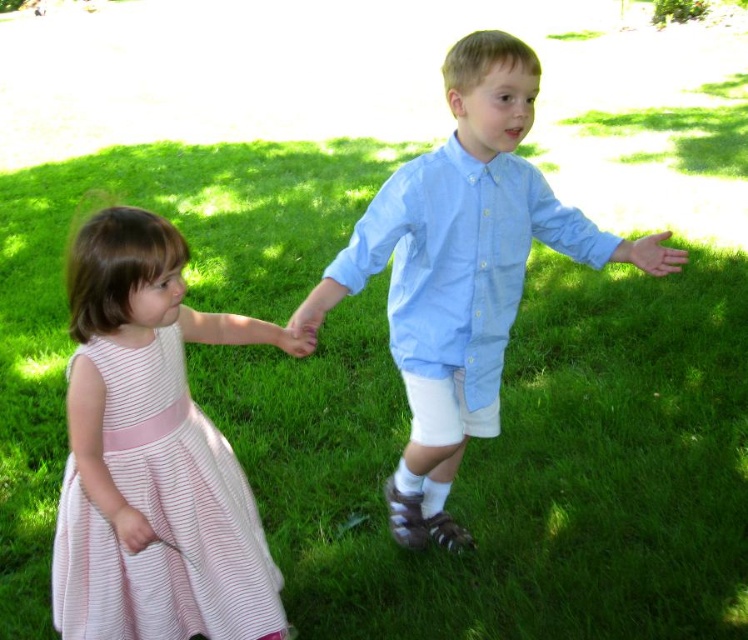
Who is more forward, (411, 545) or (218, 490)?

Point (218, 490) is in front.

Can you confirm if light blue cotton shirt at center is positioned to the left of pink striped fabric dress at left?

Incorrect, light blue cotton shirt at center is not on the left side of pink striped fabric dress at left.

You are a GUI agent. You are given a task and a screenshot of the screen. Output one action in this format:
    pyautogui.click(x=<x>, y=<y>)
    Task: Click on the light blue cotton shirt at center
    This screenshot has width=748, height=640.
    Given the screenshot: What is the action you would take?
    pyautogui.click(x=462, y=269)